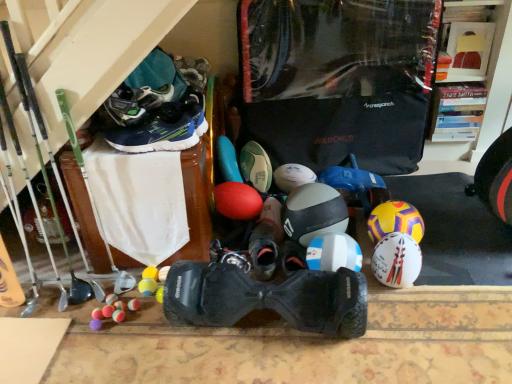
Where is `white matte helmet at center, which ranks as the third helmet in left-to-right order`? The image size is (512, 384). white matte helmet at center, which ranks as the third helmet in left-to-right order is located at coordinates (397, 260).

The width and height of the screenshot is (512, 384). In order to click on black matte sneaker at center, the second footwear viewed from the back in this screenshot , I will do `click(266, 239)`.

Measure the distance between rubber ball at center and camera.

rubber ball at center and camera are 1.82 meters apart.

The width and height of the screenshot is (512, 384). What do you see at coordinates (356, 185) in the screenshot? I see `rubber ball at center` at bounding box center [356, 185].

At what (x,y) coordinates should I click in order to perform the action: click on white matte helmet at center, the 1th helmet in the left-to-right sequence. Please return your answer as a coordinate pair (x, y). Looking at the image, I should click on (314, 212).

How much space does black rubber hoverboard at center, positioned as the 1th footwear in front-to-back order, occupy horizontally?

black rubber hoverboard at center, positioned as the 1th footwear in front-to-back order, is 8.52 inches in width.

How much space does dark blue synthetic sneakers at upper left, placed as the second footwear when sorted from front to back, occupy horizontally?

dark blue synthetic sneakers at upper left, placed as the second footwear when sorted from front to back, is 9.65 inches in width.

Locate an element on the screen. This screenshot has height=384, width=512. white matte soccer ball at center is located at coordinates (292, 176).

You are a GUI agent. You are given a task and a screenshot of the screen. Output one action in this format:
    pyautogui.click(x=<x>, y=<y>)
    Task: Click on the white matte helmet at center, the 2th helmet when ordered from right to left
    The image size is (512, 384).
    Given the screenshot: What is the action you would take?
    pyautogui.click(x=397, y=260)

Is white matte helmet at center, which is the 3th helmet from right to left, positioned far away from green matte soccer ball at center, marked as the 1th footwear in a back-to-front arrangement?

No, white matte helmet at center, which is the 3th helmet from right to left, is not far away from green matte soccer ball at center, marked as the 1th footwear in a back-to-front arrangement.

Based on the photo, how different are the orientations of white matte helmet at center, acting as the 2th helmet starting from the left, and green matte soccer ball at center, marked as the 1th footwear in a back-to-front arrangement, in degrees?

There is a 6.14-degree angle between the facing directions of white matte helmet at center, acting as the 2th helmet starting from the left, and green matte soccer ball at center, marked as the 1th footwear in a back-to-front arrangement.

Considering the positions of objects white matte helmet at center, which is the 3th helmet from right to left, and green matte soccer ball at center, marked as the 1th footwear in a back-to-front arrangement, in the image provided, who is more to the left, white matte helmet at center, which is the 3th helmet from right to left, or green matte soccer ball at center, marked as the 1th footwear in a back-to-front arrangement,?

green matte soccer ball at center, marked as the 1th footwear in a back-to-front arrangement.

Do you think white matte helmet at center, acting as the 2th helmet starting from the left, is within green matte soccer ball at center, marked as the 1th footwear in a back-to-front arrangement, or outside of it?

white matte helmet at center, acting as the 2th helmet starting from the left, is outside green matte soccer ball at center, marked as the 1th footwear in a back-to-front arrangement.

Is point (344, 247) closer or farther from the camera than point (335, 204)?

Point (344, 247) appears to be closer to the viewer than point (335, 204).

Considering the positions of objects white matte helmet at center, acting as the 2th helmet starting from the left, and white matte helmet at center, which is the fourth helmet in right-to-left order, in the image provided, who is more to the right, white matte helmet at center, acting as the 2th helmet starting from the left, or white matte helmet at center, which is the fourth helmet in right-to-left order,?

white matte helmet at center, acting as the 2th helmet starting from the left.

Is white matte helmet at center, acting as the 2th helmet starting from the left, thinner than white matte helmet at center, the 1th helmet in the left-to-right sequence?

Yes, white matte helmet at center, acting as the 2th helmet starting from the left, is thinner than white matte helmet at center, the 1th helmet in the left-to-right sequence.

Is white matte helmet at center, acting as the 2th helmet starting from the left, directly adjacent to white matte helmet at center, which is the fourth helmet in right-to-left order?

No, white matte helmet at center, acting as the 2th helmet starting from the left, is not touching white matte helmet at center, which is the fourth helmet in right-to-left order.

In terms of height, does white matte helmet at center, which is the fourth helmet in right-to-left order, look taller or shorter compared to white matte helmet at center, acting as the 2th helmet starting from the left?

Considering their sizes, white matte helmet at center, which is the fourth helmet in right-to-left order, has more height than white matte helmet at center, acting as the 2th helmet starting from the left.

Is white matte helmet at center, acting as the 2th helmet starting from the left, located within white matte helmet at center, the 1th helmet in the left-to-right sequence?

No, white matte helmet at center, acting as the 2th helmet starting from the left, is not a part of white matte helmet at center, the 1th helmet in the left-to-right sequence.

Looking at the image, does white matte helmet at center, the 1th helmet in the left-to-right sequence, seem bigger or smaller compared to white matte helmet at center, which is the 3th helmet from right to left?

Clearly, white matte helmet at center, the 1th helmet in the left-to-right sequence, is larger in size than white matte helmet at center, which is the 3th helmet from right to left.

How different are the orientations of white matte helmet at center, which ranks as the third helmet in left-to-right order, and green matte soccer ball at center, the 5th footwear when ordered from front to back, in degrees?

The angular difference between white matte helmet at center, which ranks as the third helmet in left-to-right order, and green matte soccer ball at center, the 5th footwear when ordered from front to back, is 6.14 degrees.

Considering the relative sizes of white matte helmet at center, the 2th helmet when ordered from right to left, and green matte soccer ball at center, marked as the 1th footwear in a back-to-front arrangement, in the image provided, is white matte helmet at center, the 2th helmet when ordered from right to left, bigger than green matte soccer ball at center, marked as the 1th footwear in a back-to-front arrangement,?

Incorrect, white matte helmet at center, the 2th helmet when ordered from right to left, is not larger than green matte soccer ball at center, marked as the 1th footwear in a back-to-front arrangement.

From the white matte helmet at center, which ranks as the third helmet in left-to-right order, count 3rd footwears backward and point to it. Please provide its 2D coordinates.

[(256, 166)]

Could you tell me if white matte helmet at center, the 2th helmet when ordered from right to left, is turned towards green matte soccer ball at center, the 5th footwear when ordered from front to back?

No, white matte helmet at center, the 2th helmet when ordered from right to left, is not oriented towards green matte soccer ball at center, the 5th footwear when ordered from front to back.

Based on their sizes in the image, would you say dark blue synthetic sneakers at upper left, the 4th footwear viewed from the back, is bigger or smaller than green matte soccer ball at center, marked as the 1th footwear in a back-to-front arrangement?

Clearly, dark blue synthetic sneakers at upper left, the 4th footwear viewed from the back, is smaller in size than green matte soccer ball at center, marked as the 1th footwear in a back-to-front arrangement.

Is dark blue synthetic sneakers at upper left, the 4th footwear viewed from the back, inside the boundaries of green matte soccer ball at center, marked as the 1th footwear in a back-to-front arrangement, or outside?

dark blue synthetic sneakers at upper left, the 4th footwear viewed from the back, lies outside green matte soccer ball at center, marked as the 1th footwear in a back-to-front arrangement.

Looking at their sizes, would you say dark blue synthetic sneakers at upper left, the 4th footwear viewed from the back, is wider or thinner than green matte soccer ball at center, marked as the 1th footwear in a back-to-front arrangement?

In the image, dark blue synthetic sneakers at upper left, the 4th footwear viewed from the back, appears to be more narrow than green matte soccer ball at center, marked as the 1th footwear in a back-to-front arrangement.

From the picture: Does dark blue synthetic sneakers at upper left, placed as the second footwear when sorted from front to back, appear on the left side of green matte soccer ball at center, the 5th footwear when ordered from front to back?

Correct, you'll find dark blue synthetic sneakers at upper left, placed as the second footwear when sorted from front to back, to the left of green matte soccer ball at center, the 5th footwear when ordered from front to back.

From the image's perspective, starting from the white matte helmet at center, which ranks as the third helmet in left-to-right order, which footwear is the 2nd one above? Please provide its 2D coordinates.

[(256, 166)]

Does point (245, 172) lie in front of point (387, 261)?

No, (245, 172) is behind (387, 261).

Is green matte soccer ball at center, the 5th footwear when ordered from front to back, facing away from white matte helmet at center, the 2th helmet when ordered from right to left?

That's not correct — green matte soccer ball at center, the 5th footwear when ordered from front to back, is not looking away from white matte helmet at center, the 2th helmet when ordered from right to left.

Is green matte soccer ball at center, the 5th footwear when ordered from front to back, not inside white matte helmet at center, which ranks as the third helmet in left-to-right order?

Yes, green matte soccer ball at center, the 5th footwear when ordered from front to back, is not within white matte helmet at center, which ranks as the third helmet in left-to-right order.

Can you confirm if dark blue synthetic sneakers at upper left, the 4th footwear viewed from the back, is smaller than black matte sneaker at center, the second footwear viewed from the back?

No, dark blue synthetic sneakers at upper left, the 4th footwear viewed from the back, is not smaller than black matte sneaker at center, the second footwear viewed from the back.

From the image's perspective, which object appears higher, dark blue synthetic sneakers at upper left, placed as the second footwear when sorted from front to back, or black matte sneaker at center, the second footwear viewed from the back?

dark blue synthetic sneakers at upper left, placed as the second footwear when sorted from front to back, is shown above in the image.

Which object is closer to the camera, dark blue synthetic sneakers at upper left, the 4th footwear viewed from the back, or black matte sneaker at center, which is counted as the 4th footwear, starting from the front?

dark blue synthetic sneakers at upper left, the 4th footwear viewed from the back.

Is dark blue synthetic sneakers at upper left, placed as the second footwear when sorted from front to back, taller than black matte sneaker at center, which is counted as the 4th footwear, starting from the front?

Indeed, dark blue synthetic sneakers at upper left, placed as the second footwear when sorted from front to back, has a greater height compared to black matte sneaker at center, which is counted as the 4th footwear, starting from the front.

Locate an element on the screen. This screenshot has height=384, width=512. the 3rd helmet located beneath the green matte soccer ball at center, the 5th footwear when ordered from front to back (from a real-world perspective) is located at coordinates (334, 253).

From the white matte helmet at center, the 1th helmet in the left-to-right sequence, count 1st helmets forward and point to it. Please provide its 2D coordinates.

[(334, 253)]

Estimate the real-world distances between objects in this image. Which object is closer to white matte helmet at right, arranged as the 1th helmet when viewed from the right, green synthetic running shoe at upper left, the third footwear when ordered from back to front, or white matte helmet at center, acting as the 2th helmet starting from the left?

white matte helmet at center, acting as the 2th helmet starting from the left.

From the image, which object appears to be farther from black matte sneaker at center, the second footwear viewed from the back, white matte helmet at right, arranged as the 1th helmet when viewed from the right, or green synthetic running shoe at upper left, which is the 3th footwear in front-to-back order?

green synthetic running shoe at upper left, which is the 3th footwear in front-to-back order, is positioned further to the anchor black matte sneaker at center, the second footwear viewed from the back.

Considering their positions, is rubber ball at center positioned further to green matte soccer ball at center, the 5th footwear when ordered from front to back, than white matte helmet at center, which ranks as the third helmet in left-to-right order?

white matte helmet at center, which ranks as the third helmet in left-to-right order.

Which object lies nearer to the anchor point white matte soccer ball at center, white matte helmet at center, the 1th helmet in the left-to-right sequence, or black matte sneaker at center, which is counted as the 4th footwear, starting from the front?

black matte sneaker at center, which is counted as the 4th footwear, starting from the front, is positioned closer to the anchor white matte soccer ball at center.

Which object lies further to the anchor point white matte helmet at center, acting as the 2th helmet starting from the left, rubber ball at center or dark blue synthetic sneakers at upper left, placed as the second footwear when sorted from front to back?

dark blue synthetic sneakers at upper left, placed as the second footwear when sorted from front to back, is positioned further to the anchor white matte helmet at center, acting as the 2th helmet starting from the left.

Considering their positions, is black rubber hoverboard at center, marked as the 5th footwear in a back-to-front arrangement, positioned closer to green matte soccer ball at center, the 5th footwear when ordered from front to back, than green synthetic running shoe at upper left, the third footwear when ordered from back to front?

green synthetic running shoe at upper left, the third footwear when ordered from back to front, lies closer to green matte soccer ball at center, the 5th footwear when ordered from front to back, than the other object.

Estimate the real-world distances between objects in this image. Which object is closer to white matte helmet at center, which is the fourth helmet in right-to-left order, white matte helmet at right, arranged as the 1th helmet when viewed from the right, or white matte helmet at center, which is the 3th helmet from right to left?

Among the two, white matte helmet at center, which is the 3th helmet from right to left, is located nearer to white matte helmet at center, which is the fourth helmet in right-to-left order.

Looking at the image, which one is located closer to white matte helmet at center, the 2th helmet when ordered from right to left, dark blue synthetic sneakers at upper left, placed as the second footwear when sorted from front to back, or white matte helmet at right, which is the 4th helmet in left-to-right order?

white matte helmet at right, which is the 4th helmet in left-to-right order, lies closer to white matte helmet at center, the 2th helmet when ordered from right to left, than the other object.

Where is `footwear between black matte sneaker at center, the second footwear viewed from the back, and white matte helmet at right, which is the 4th helmet in left-to-right order, in the horizontal direction`? This screenshot has height=384, width=512. footwear between black matte sneaker at center, the second footwear viewed from the back, and white matte helmet at right, which is the 4th helmet in left-to-right order, in the horizontal direction is located at coordinates [266, 298].

Locate an element on the screen. ball between green matte soccer ball at center, marked as the 1th footwear in a back-to-front arrangement, and white matte helmet at right, which is the 4th helmet in left-to-right order is located at coordinates (292, 176).

The image size is (512, 384). In order to click on toy located between black rubber hoverboard at center, positioned as the 1th footwear in front-to-back order, and green matte soccer ball at center, marked as the 1th footwear in a back-to-front arrangement, in the depth direction in this screenshot , I will do `click(356, 185)`.

Locate an element on the screen. This screenshot has height=384, width=512. toy between black matte sneaker at center, which is counted as the 4th footwear, starting from the front, and white matte helmet at right, arranged as the 1th helmet when viewed from the right is located at coordinates (356, 185).